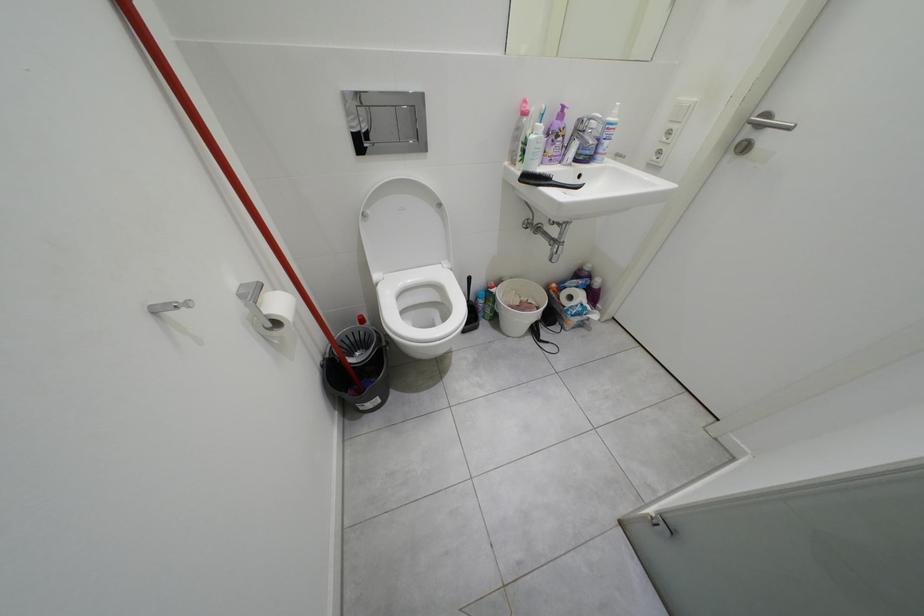
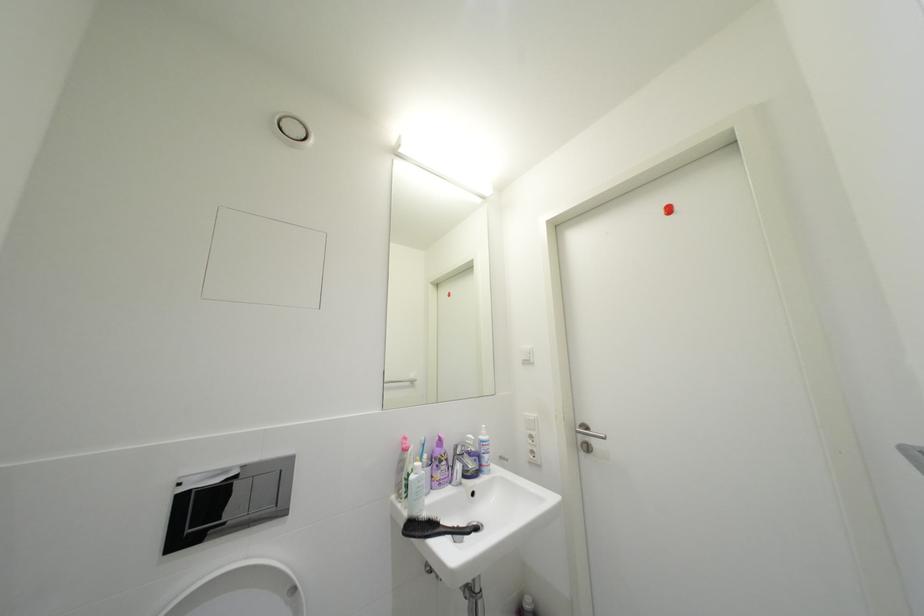
In the scene shown: First-person continuous shooting, in which direction is the camera rotating?

The camera rotated toward right-up.